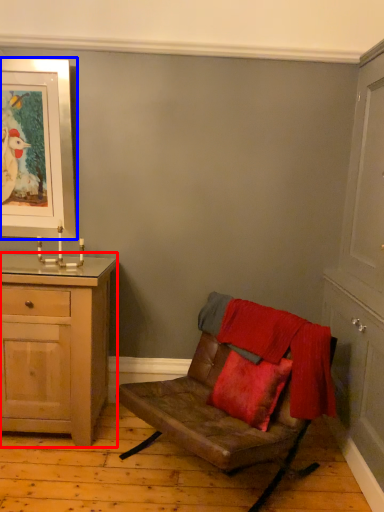
Question: Which object is further to the camera taking this photo, chest of drawers (highlighted by a red box) or picture frame (highlighted by a blue box)?

Choices:
 (A) chest of drawers
 (B) picture frame

Answer: (B)